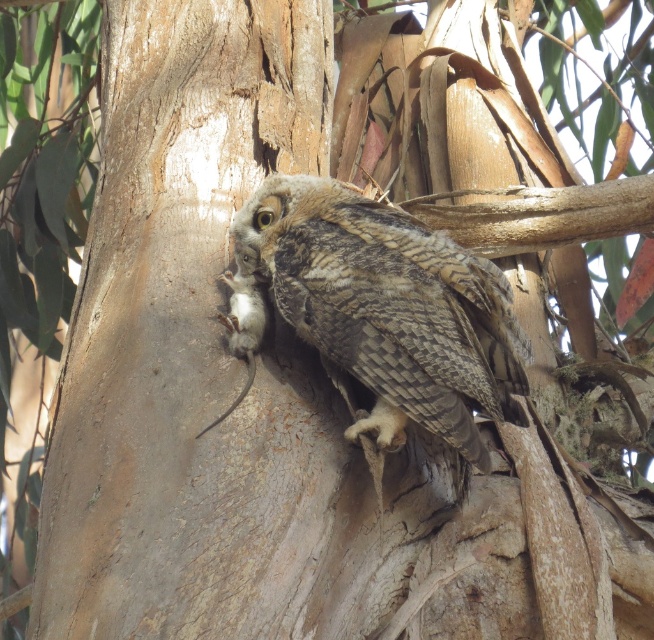
Question: Considering the relative positions of smooth brown bark at center and camouflage feathered owl at center in the image provided, where is smooth brown bark at center located with respect to camouflage feathered owl at center?

Choices:
 (A) above
 (B) below

Answer: (A)

Question: Is smooth brown bark at center smaller than camouflage feathered owl at center?

Choices:
 (A) yes
 (B) no

Answer: (B)

Question: Which point appears closest to the camera in this image?

Choices:
 (A) pos(129,529)
 (B) pos(290,291)

Answer: (A)

Question: Can you confirm if smooth brown bark at center is thinner than camouflage feathered owl at center?

Choices:
 (A) no
 (B) yes

Answer: (B)